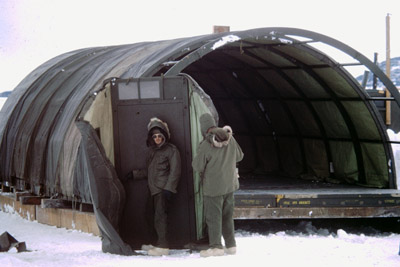
Identify the location of hood. The width and height of the screenshot is (400, 267). (222, 130).